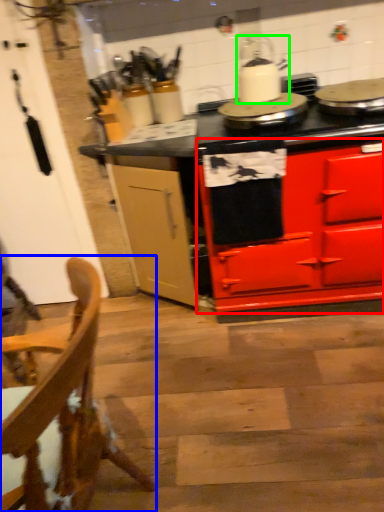
Question: Estimate the real-world distances between objects in this image. Which object is farther from cabinetry (highlighted by a red box), chair (highlighted by a blue box) or kitchen appliance (highlighted by a green box)?

Choices:
 (A) chair
 (B) kitchen appliance

Answer: (A)